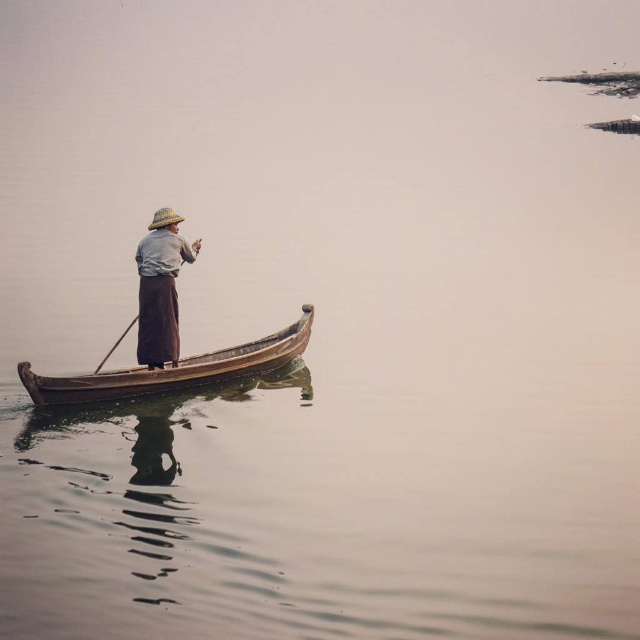
Question: Where is wooden canoe at center located in relation to brown woven hat at center in the image?

Choices:
 (A) above
 (B) below

Answer: (B)

Question: Estimate the real-world distances between objects in this image. Which object is closer to the wooden paddle at center?

Choices:
 (A) wooden canoe at center
 (B) brown woven hat at center

Answer: (B)

Question: Among these points, which one is farthest from the camera?

Choices:
 (A) (176, 212)
 (B) (124, 330)
 (C) (228, 371)

Answer: (C)

Question: Which object appears farthest from the camera in this image?

Choices:
 (A) brown woven hat at center
 (B) wooden canoe at center

Answer: (A)

Question: Does wooden canoe at center appear on the right side of wooden paddle at center?

Choices:
 (A) no
 (B) yes

Answer: (B)

Question: Is wooden canoe at center wider than wooden paddle at center?

Choices:
 (A) yes
 (B) no

Answer: (A)